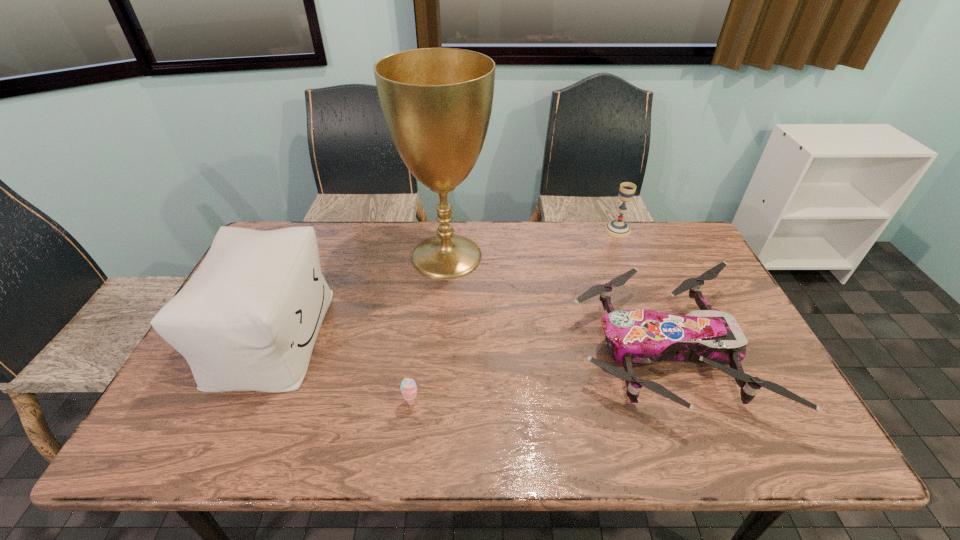
Image resolution: width=960 pixels, height=540 pixels. In order to click on vacant point located between the third detergent from left to right and the smallest white detergent in this screenshot , I will do `click(562, 343)`.

Locate an element on the screen. This screenshot has height=540, width=960. free space between the seventh shortest object and the shortest object is located at coordinates (252, 328).

The height and width of the screenshot is (540, 960). Identify the location of the fifth closest object to the fourth detergent from right to left. (202, 365).

I want to click on object that is the fourth closest to the brown radio receiver, so click(505, 293).

At what (x,y) coordinates should I click in order to perform the action: click on detergent that stands as the closest to the farther blue detergent. Please return your answer as a coordinate pair (x, y). The height and width of the screenshot is (540, 960). Looking at the image, I should click on (245, 199).

The width and height of the screenshot is (960, 540). I want to click on detergent that is the closest to the rightmost white detergent, so click(x=571, y=132).

At what (x,y) coordinates should I click in order to perform the action: click on white detergent that is the closest to the nearest white detergent. Please return your answer as a coordinate pair (x, y). This screenshot has width=960, height=540. Looking at the image, I should click on (571, 132).

Identify which white detergent is the fourth closest to the bigger blue detergent. Please provide its 2D coordinates. Your answer should be formatted as a tuple, i.e. [(x, y)], where the tuple contains the x and y coordinates of a point satisfying the conditions above.

[(685, 172)]

In order to click on vacant space that satisfies the following two spatial constraints: 1. on the back side of the blue pottery; 2. on the right side of the rightmost white detergent in this screenshot , I will do `click(300, 219)`.

Identify the location of free space in the image that satisfies the following two spatial constraints: 1. on the back side of the tallest detergent; 2. on the left side of the smaller blue detergent. (497, 214).